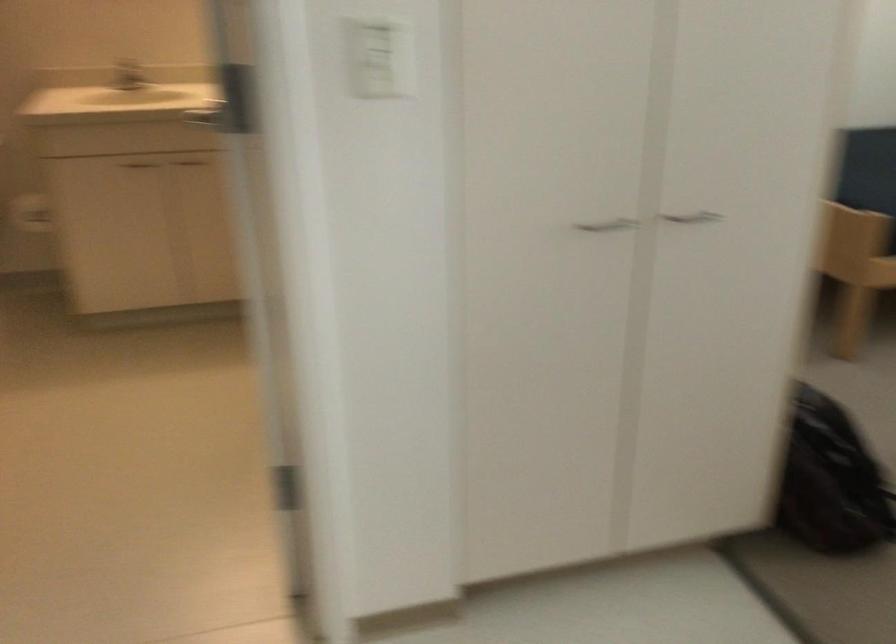
This screenshot has height=644, width=896. What do you see at coordinates (855, 269) in the screenshot?
I see `the chair sitting surface` at bounding box center [855, 269].